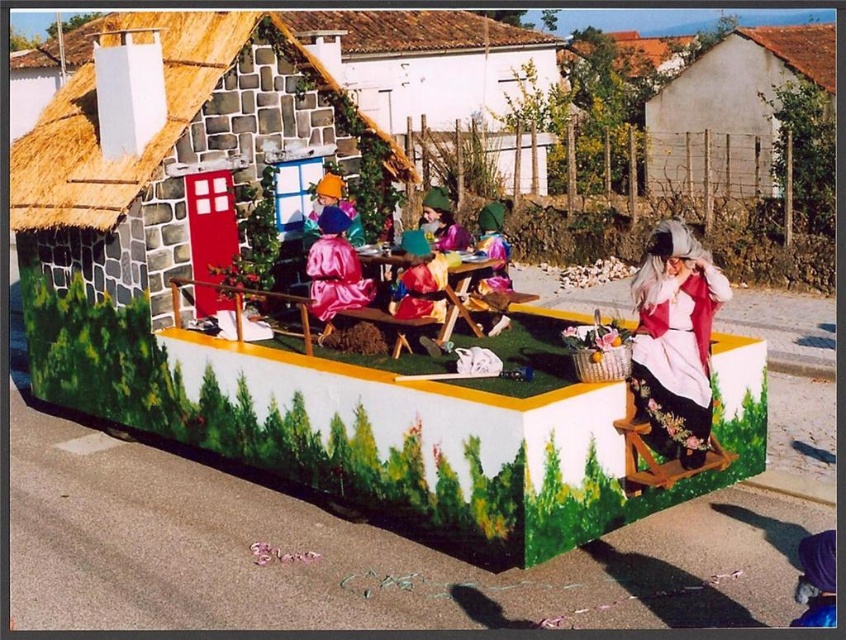
Does point (743, 33) come in front of point (635, 413)?

No, (743, 33) is further to viewer.

Which is in front, point (724, 132) or point (669, 284)?

Point (669, 284) is more forward.

Is point (759, 26) closer to camera compared to point (643, 332)?

No, (759, 26) is further to viewer.

You are a GUI agent. You are given a task and a screenshot of the screen. Output one action in this format:
    pyautogui.click(x=<x>, y=<y>)
    Task: Click on the white painted wood at upper right
    The width and height of the screenshot is (846, 640).
    Given the screenshot: What is the action you would take?
    pyautogui.click(x=731, y=109)

Is shiny purple dress at center to the right of velvet purple dress at center from the viewer's perspective?

Indeed, shiny purple dress at center is positioned on the right side of velvet purple dress at center.

Is point (476, 244) positioned before point (327, 192)?

No.

Locate an element on the screen. The width and height of the screenshot is (846, 640). shiny purple dress at center is located at coordinates (492, 252).

Does point (266, 61) come closer to viewer compared to point (493, 227)?

No, (266, 61) is further to viewer.

This screenshot has width=846, height=640. Find the location of `stone textured hut at center`. stone textured hut at center is located at coordinates (168, 152).